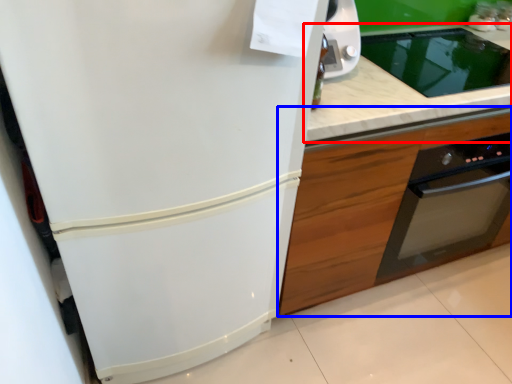
Question: Which object appears farthest to the camera in this image, countertop (highlighted by a red box) or cabinetry (highlighted by a blue box)?

Choices:
 (A) countertop
 (B) cabinetry

Answer: (B)